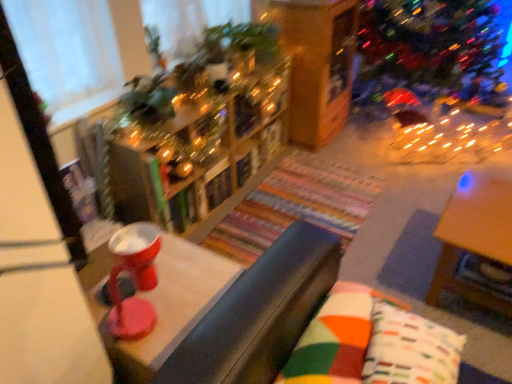
Identify the location of vacant space situated above wooden table at right, acting as the 2th table starting from the left (from a real-world perspective). (483, 201).